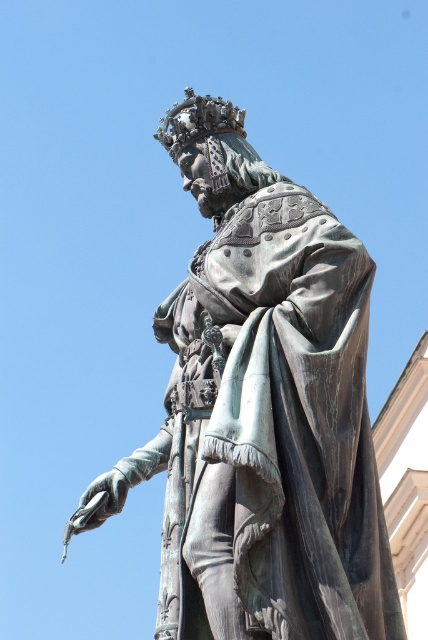
Question: Which of the following is the farthest from the observer?

Choices:
 (A) bronze statue at center
 (B) shiny gold crown at upper center

Answer: (B)

Question: Does bronze statue at center appear on the left side of shiny gold crown at upper center?

Choices:
 (A) yes
 (B) no

Answer: (B)

Question: Among these points, which one is farthest from the camera?

Choices:
 (A) (198, 109)
 (B) (303, 461)

Answer: (A)

Question: Does bronze statue at center have a greater width compared to shiny gold crown at upper center?

Choices:
 (A) yes
 (B) no

Answer: (A)

Question: Where is bronze statue at center located in relation to shiny gold crown at upper center in the image?

Choices:
 (A) above
 (B) below

Answer: (B)